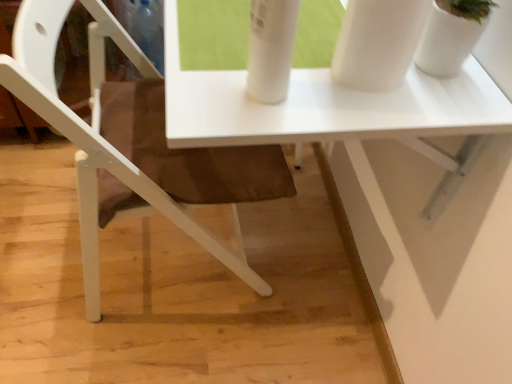
This screenshot has height=384, width=512. What are the coordinates of `vacant space that is to the left of white matte chair at lower left` in the screenshot? It's located at (42, 233).